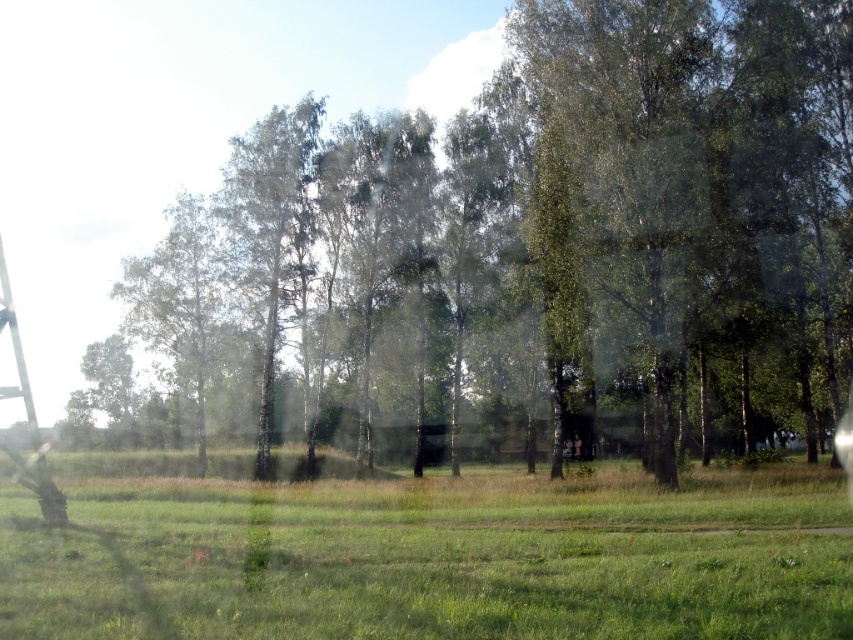
Is green grass at center smaller than metallic silver ladder at left?

Indeed, green grass at center has a smaller size compared to metallic silver ladder at left.

Which of these two, green grass at center or metallic silver ladder at left, stands shorter?

green grass at center

The height and width of the screenshot is (640, 853). I want to click on green grass at center, so click(436, 557).

Is green leafy tree at center above green grass at center?

Yes, green leafy tree at center is above green grass at center.

Who is positioned more to the right, green leafy tree at center or green grass at center?

From the viewer's perspective, green leafy tree at center appears more on the right side.

Locate an element on the screen. green leafy tree at center is located at coordinates (573, 243).

Does green leafy tree at center have a lesser width compared to metallic silver ladder at left?

In fact, green leafy tree at center might be wider than metallic silver ladder at left.

Who is shorter, green leafy tree at center or metallic silver ladder at left?

metallic silver ladder at left is shorter.

Where is `green leafy tree at center`? Image resolution: width=853 pixels, height=640 pixels. green leafy tree at center is located at coordinates (573, 243).